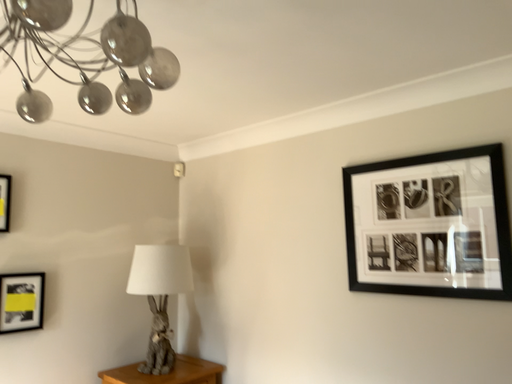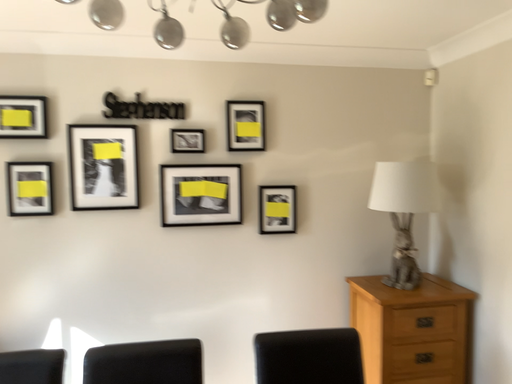
Question: Which way did the camera rotate in the video?

Choices:
 (A) rotated downward
 (B) rotated upward

Answer: (A)